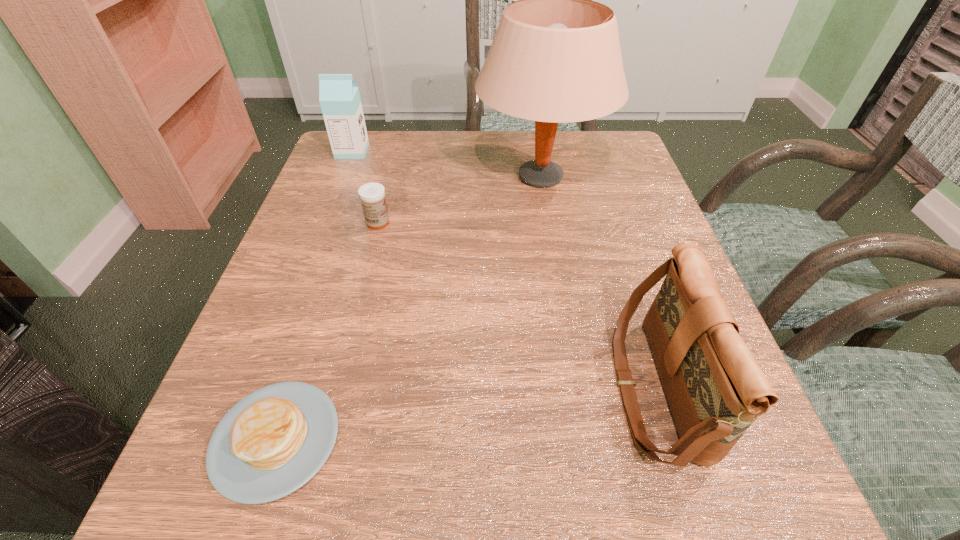
The image size is (960, 540). I want to click on shoulder bag present at the right edge, so click(715, 388).

Identify the location of object at the far left corner. (339, 97).

At what (x,y) coordinates should I click in order to perform the action: click on object present at the near left corner. Please return your answer as a coordinate pair (x, y). Looking at the image, I should click on (272, 442).

Where is `object present at the far right corner`? The image size is (960, 540). object present at the far right corner is located at coordinates (555, 58).

The width and height of the screenshot is (960, 540). Identify the location of object present at the near right corner. (715, 388).

At what (x,y) coordinates should I click in order to perform the action: click on free space at the far edge of the desktop. Please return your answer as a coordinate pair (x, y). Looking at the image, I should click on (435, 148).

Where is `free space at the near edge of the desktop`? free space at the near edge of the desktop is located at coordinates (508, 488).

This screenshot has height=540, width=960. Find the location of `blank area at the left edge`. blank area at the left edge is located at coordinates (292, 277).

Image resolution: width=960 pixels, height=540 pixels. In order to click on vacant space at the right edge of the desktop in this screenshot , I will do `click(638, 308)`.

Image resolution: width=960 pixels, height=540 pixels. In the image, there is a desktop. Identify the location of vacant space at the far left corner. (377, 168).